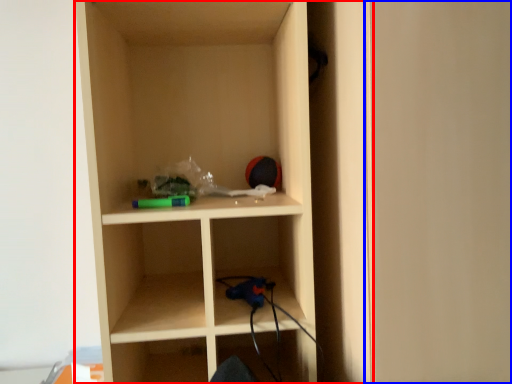
Question: Which object appears farthest to the camera in this image, shelf (highlighted by a red box) or door (highlighted by a blue box)?

Choices:
 (A) shelf
 (B) door

Answer: (A)